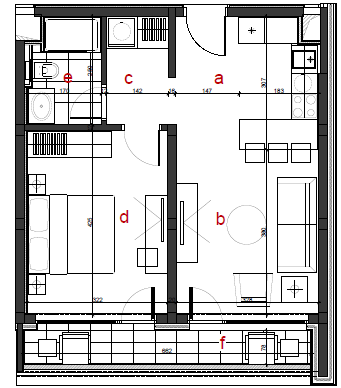
The image size is (341, 388). Identify the location of television. (183, 222), (159, 221).